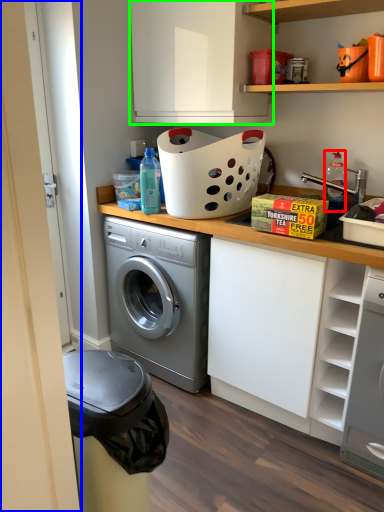
Question: Which object is the farthest from bottle (highlighted by a red box)? Choose among these: door (highlighted by a blue box) or cabinetry (highlighted by a green box).

Choices:
 (A) door
 (B) cabinetry

Answer: (A)